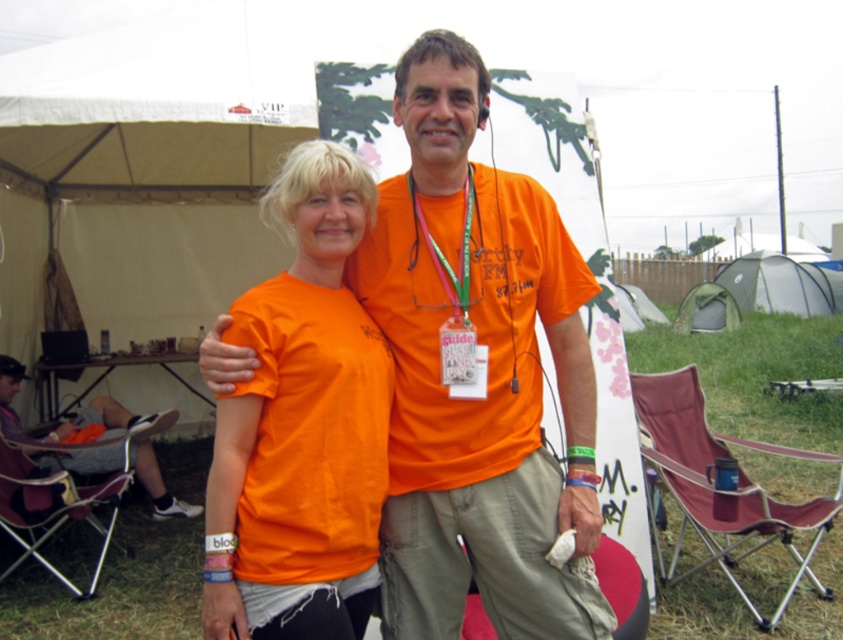
Question: Among these objects, which one is farthest from the camera?

Choices:
 (A) orange matte neck at center
 (B) green fabric tent at center
 (C) green fabric tent at right
 (D) orange fabric at center

Answer: (C)

Question: Considering the real-world distances, which object is farthest from the orange matte neck at center?

Choices:
 (A) orange cotton shirt at lower left
 (B) green fabric tent at right
 (C) green fabric tent at center

Answer: (B)

Question: Which point is farther to the camera?

Choices:
 (A) (725, 307)
 (B) (146, 470)
 (C) (303, 433)
 (D) (458, 160)

Answer: (A)

Question: Considering the relative positions of matte orange t-shirt at center and orange matte t-shirt at center in the image provided, where is matte orange t-shirt at center located with respect to orange matte t-shirt at center?

Choices:
 (A) above
 (B) below

Answer: (A)

Question: Is matte orange t-shirt at center to the left of orange cotton shirt at lower left from the viewer's perspective?

Choices:
 (A) no
 (B) yes

Answer: (A)

Question: Is orange fabric at center below green fabric tent at center?

Choices:
 (A) no
 (B) yes

Answer: (B)